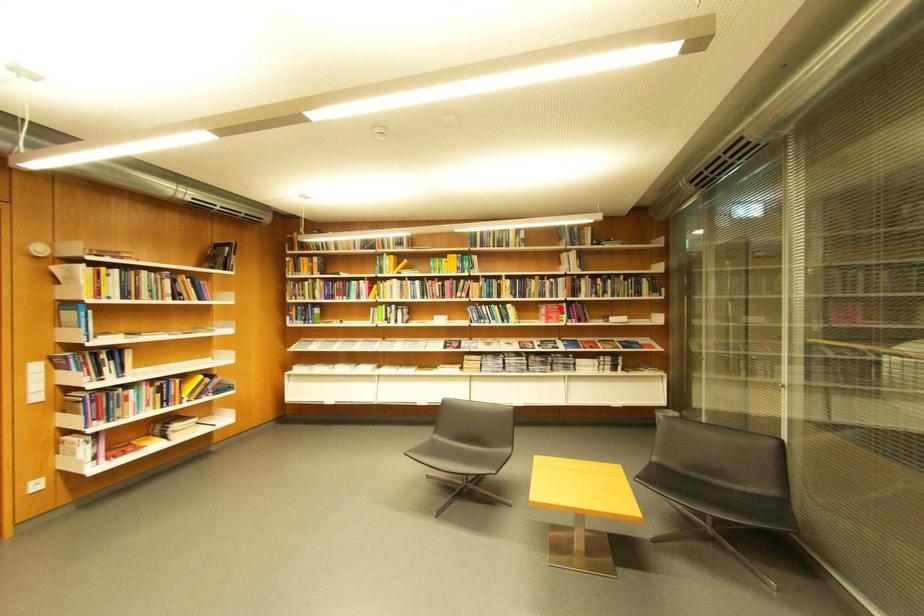
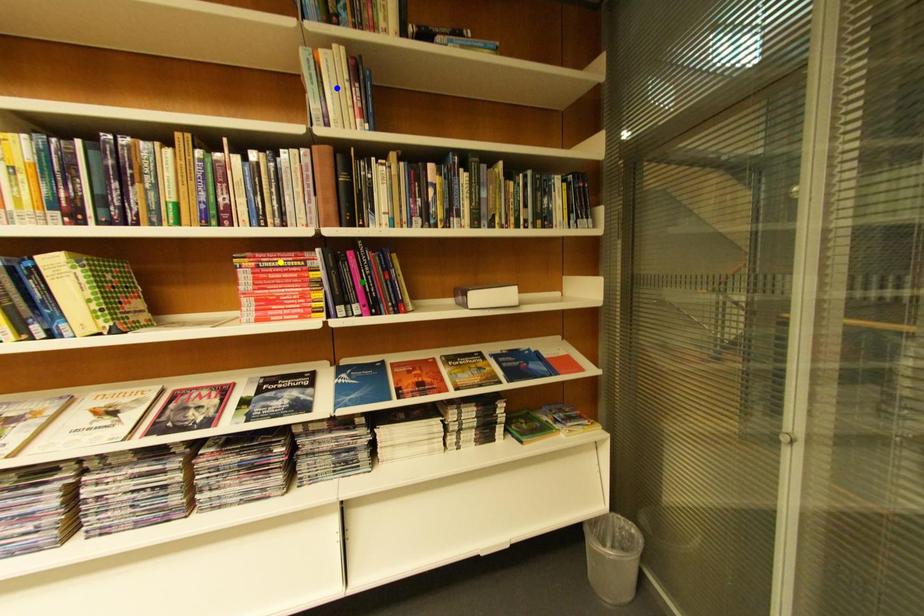
Question: I am providing you with two images of the same scene from different viewpoints. A red point is marked on the first image. You are given multiple points on the second image. Can you choose the point in image 2 that corresponds to the point in image 1?

Choices:
 (A) green point
 (B) blue point
 (C) yellow point

Answer: (C)